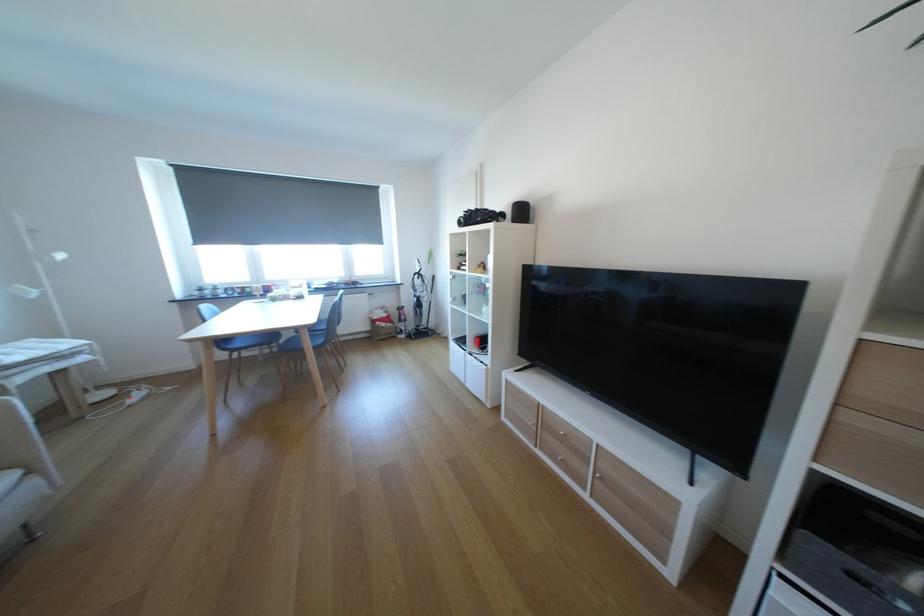
Find where to pull the silver drawer knob. Please return your answer as a coordinate pair (x, y).

(533, 424)